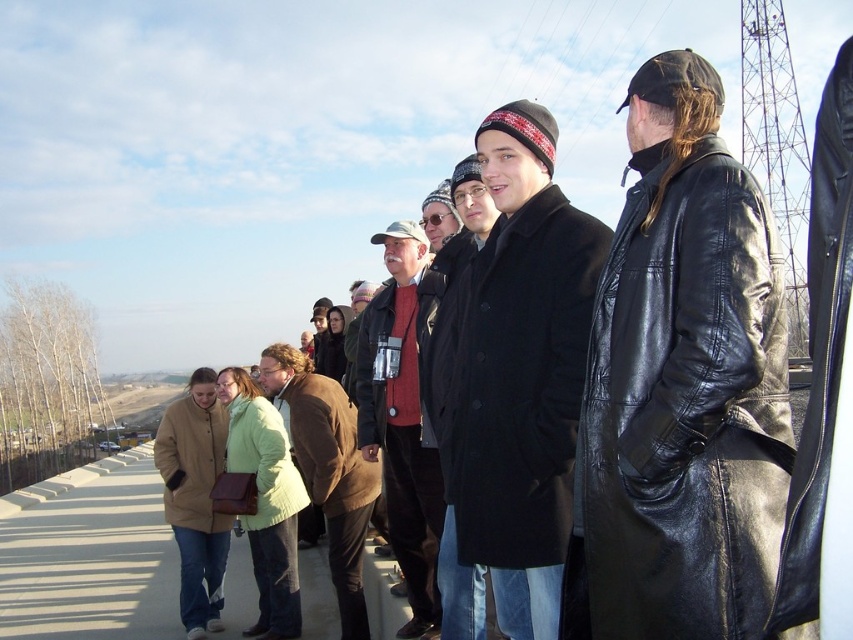
Does brown leather jacket at lower left lie behind light green fabric jacket at center?

No, it is in front of light green fabric jacket at center.

Who is more distant from viewer, (338, 468) or (242, 413)?

The point (242, 413) is behind.

Identify the location of brown leather jacket at lower left. (328, 468).

At what (x,y) coordinates should I click in order to perform the action: click on light green fabric jacket at center. Please return your answer as a coordinate pair (x, y). Looking at the image, I should click on (265, 500).

In the scene shown: Who is more forward, (x=260, y=442) or (x=473, y=157)?

Positioned in front is point (x=473, y=157).

This screenshot has height=640, width=853. Identify the location of light green fabric jacket at center. (265, 500).

Which is behind, point (630, 305) or point (412, 611)?

The point (412, 611) is more distant.

Consider the image. Which is below, black leather coat at center or matte red sweater at center?

matte red sweater at center

What do you see at coordinates (682, 387) in the screenshot?
I see `black leather coat at center` at bounding box center [682, 387].

I want to click on black leather coat at center, so point(682,387).